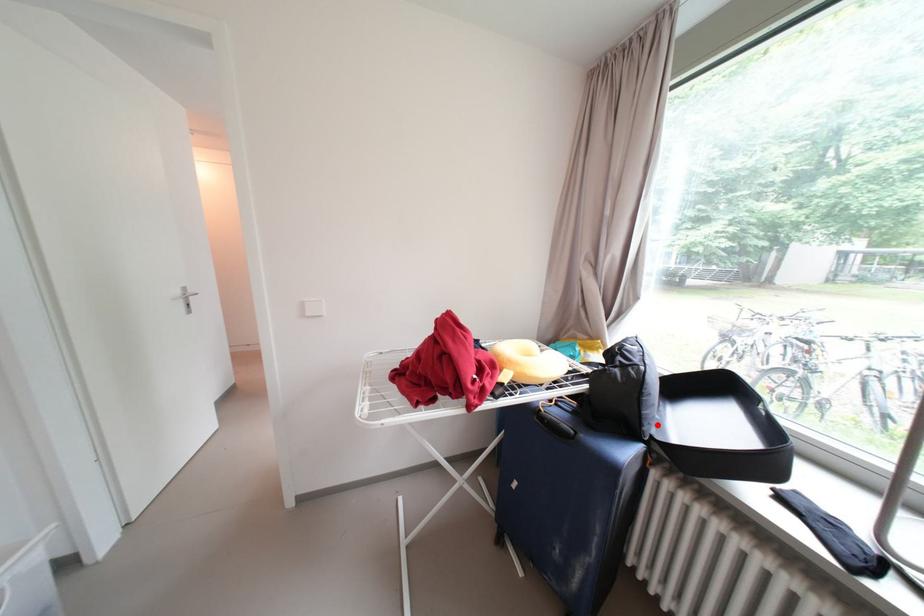
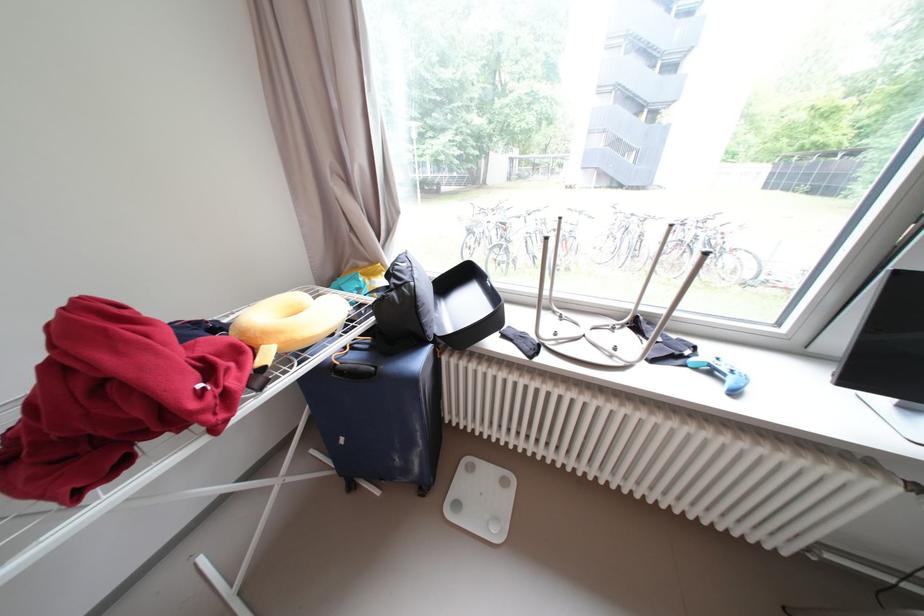
Question: I am providing you with two images of the same scene from different viewpoints. A red point is shown in image1. For the corresponding object point in image2, is it positioned nearer or farther from the camera?

Choices:
 (A) Nearer
 (B) Farther

Answer: (A)